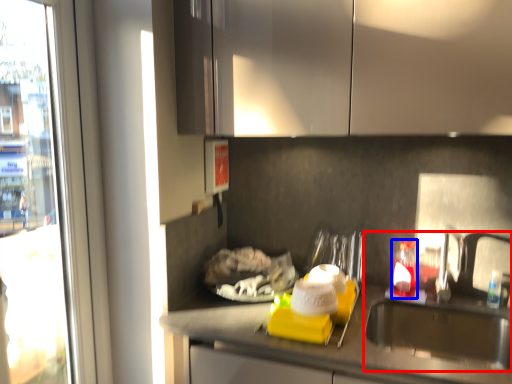
Question: Which object is closer to the camera taking this photo, sink (highlighted by a red box) or bottle (highlighted by a blue box)?

Choices:
 (A) sink
 (B) bottle

Answer: (A)